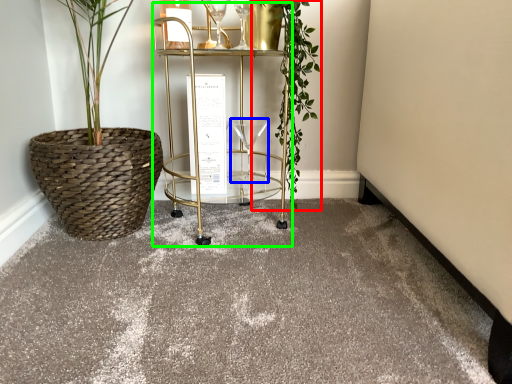
Question: Which object is the farthest from vegetation (highlighted by a red box)? Choose among these: wine glass (highlighted by a blue box) or cart (highlighted by a green box).

Choices:
 (A) wine glass
 (B) cart

Answer: (A)